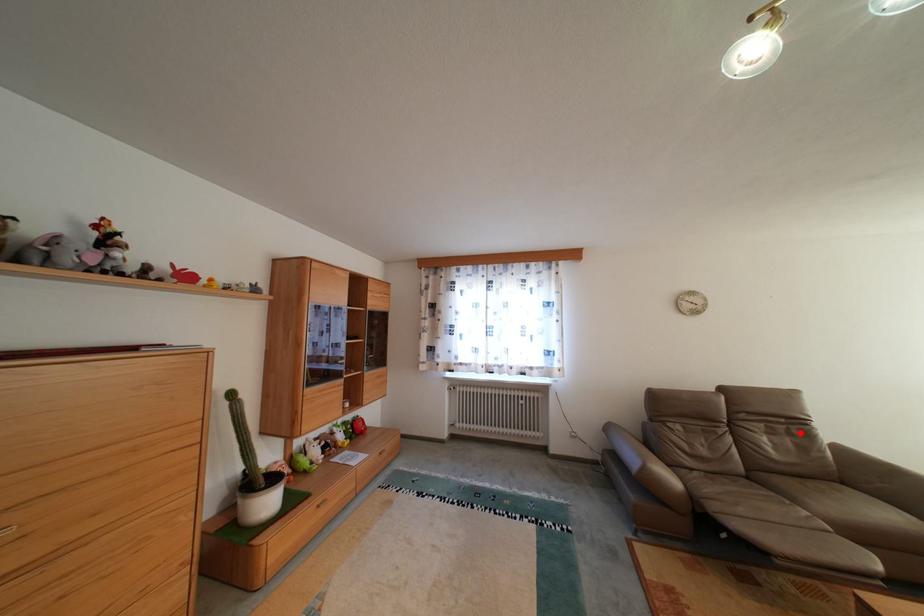
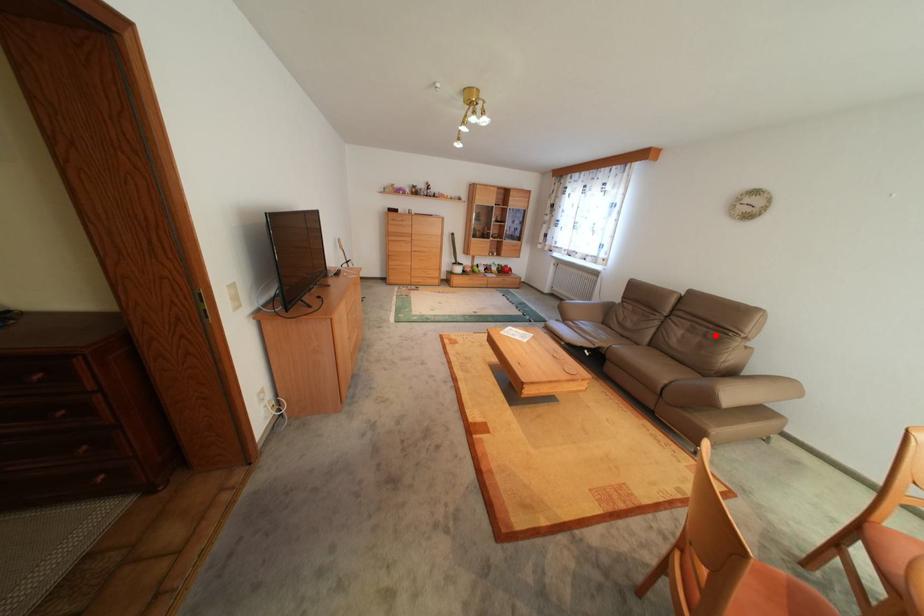
Looking at this image, I am providing you with two images of the same scene from different viewpoints. A red point is marked on the first image and another point is marked on the second image. Is the marked point in image1 the same physical position as the marked point in image2?

Yes